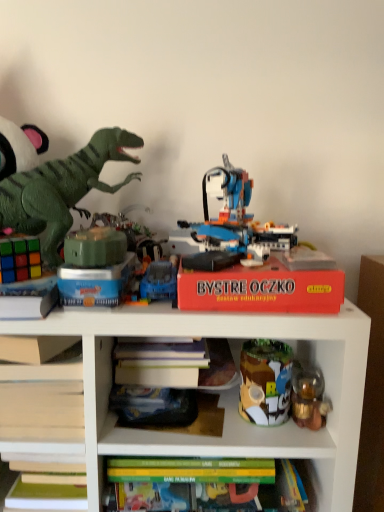
Question: From a real-world perspective, is red cardboard box at upper center over green plastic dinosaur at left, which is the sixth toy from right to left?

Choices:
 (A) no
 (B) yes

Answer: (A)

Question: Considering the relative sizes of red cardboard box at upper center and green plastic dinosaur at left, which is the sixth toy from right to left, in the image provided, is red cardboard box at upper center thinner than green plastic dinosaur at left, which is the sixth toy from right to left,?

Choices:
 (A) no
 (B) yes

Answer: (A)

Question: Is red cardboard box at upper center shorter than green plastic dinosaur at left, which is the sixth toy from right to left?

Choices:
 (A) no
 (B) yes

Answer: (A)

Question: Is red cardboard box at upper center wider than green plastic dinosaur at left, marked as the second toy in a left-to-right arrangement?

Choices:
 (A) no
 (B) yes

Answer: (B)

Question: Considering the relative sizes of red cardboard box at upper center and green plastic dinosaur at left, which is the sixth toy from right to left, in the image provided, is red cardboard box at upper center taller than green plastic dinosaur at left, which is the sixth toy from right to left,?

Choices:
 (A) yes
 (B) no

Answer: (A)

Question: Does point (178, 327) appear closer or farther from the camera than point (89, 227)?

Choices:
 (A) closer
 (B) farther

Answer: (A)

Question: Do you think red cardboard box at upper center is within green matte cube at center, arranged as the fifth toy when viewed from the right, or outside of it?

Choices:
 (A) outside
 (B) inside

Answer: (A)

Question: In terms of width, does red cardboard box at upper center look wider or thinner when compared to green matte cube at center, arranged as the fifth toy when viewed from the right?

Choices:
 (A) thin
 (B) wide

Answer: (B)

Question: From the image's perspective, is red cardboard box at upper center positioned above or below green matte cube at center, placed as the third toy when sorted from left to right?

Choices:
 (A) below
 (B) above

Answer: (A)

Question: From a real-world perspective, is metallic tin can at center right, which appears as the 6th toy when viewed from the left, above or below red cardboard box at upper center?

Choices:
 (A) below
 (B) above

Answer: (B)

Question: Looking at their shapes, would you say metallic tin can at center right, which appears as the 6th toy when viewed from the left, is wider or thinner than red cardboard box at upper center?

Choices:
 (A) wide
 (B) thin

Answer: (B)

Question: Relative to red cardboard box at upper center, is metallic tin can at center right, the 2th toy when ordered from right to left, in front or behind?

Choices:
 (A) behind
 (B) front

Answer: (A)

Question: In terms of height, does metallic tin can at center right, the 2th toy when ordered from right to left, look taller or shorter compared to red cardboard box at upper center?

Choices:
 (A) tall
 (B) short

Answer: (B)

Question: Is gold metallic lantern at right, marked as the first toy in a right-to-left arrangement, situated inside red cardboard box at upper center or outside?

Choices:
 (A) outside
 (B) inside

Answer: (B)

Question: Is gold metallic lantern at right, the 7th toy from the left, wider or thinner than red cardboard box at upper center?

Choices:
 (A) wide
 (B) thin

Answer: (B)